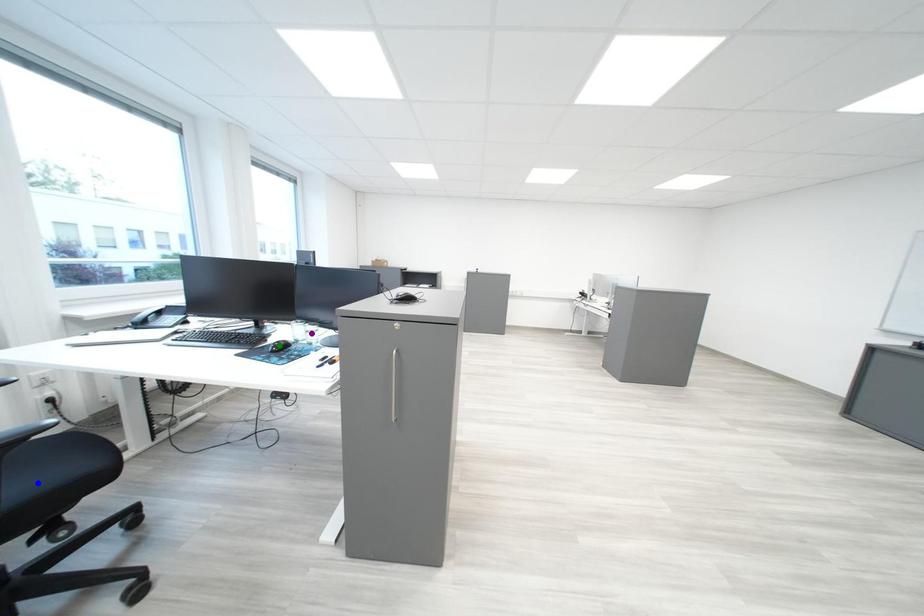
Order these from nearest to farthest:
green point
blue point
purple point

blue point, purple point, green point